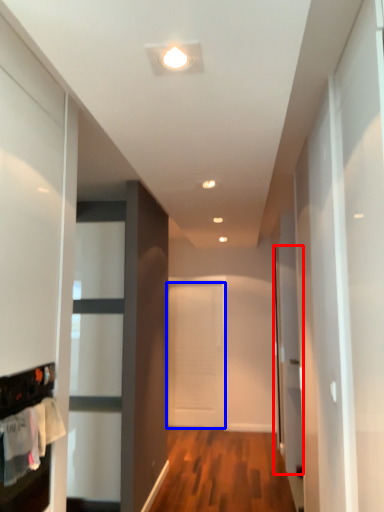
Question: Which object appears farthest to the camera in this image, glass door (highlighted by a red box) or door (highlighted by a blue box)?

Choices:
 (A) glass door
 (B) door

Answer: (B)